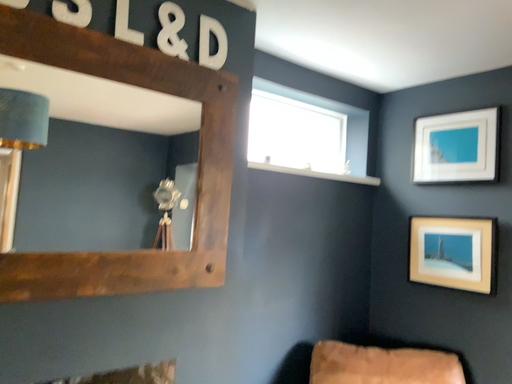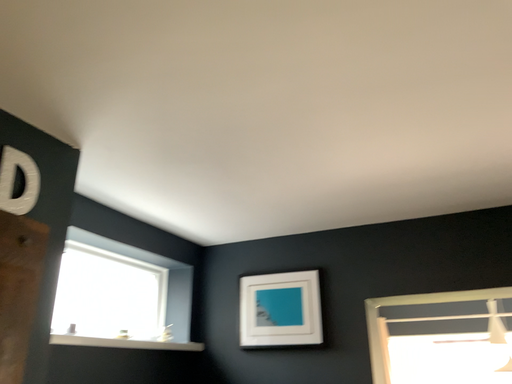
Question: How did the camera likely rotate when shooting the video?

Choices:
 (A) rotated left
 (B) rotated right

Answer: (B)